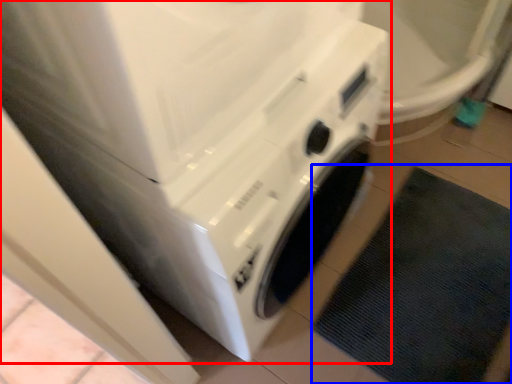
Question: Which object is further to the camera taking this photo, washing machine (highlighted by a red box) or bath mat (highlighted by a blue box)?

Choices:
 (A) washing machine
 (B) bath mat

Answer: (B)